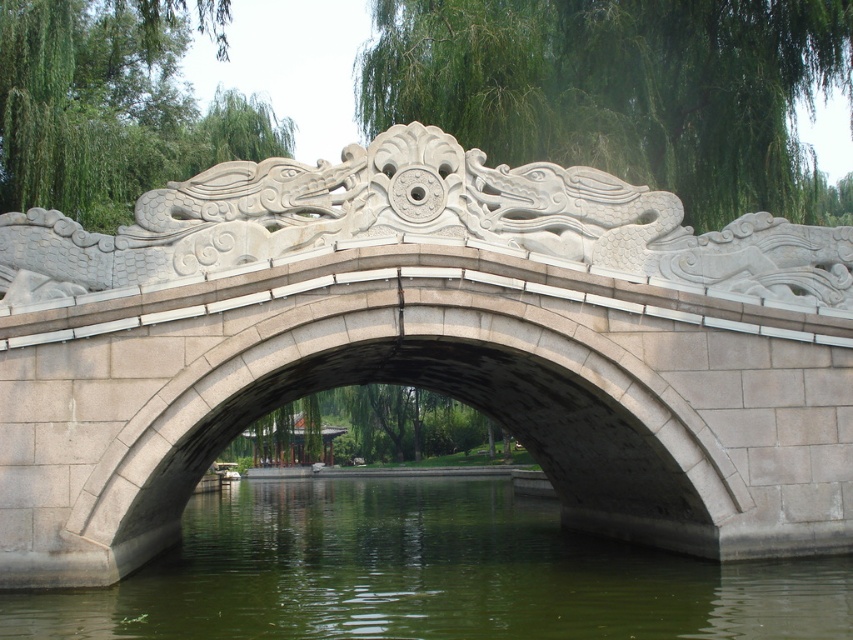
Question: Which point is closer to the camera?

Choices:
 (A) white stone bridge at center
 (B) green stone water at center

Answer: (B)

Question: Which of the following is the closest to the observer?

Choices:
 (A) green stone water at center
 (B) white stone bridge at center

Answer: (A)

Question: Which point appears farthest from the camera in this image?

Choices:
 (A) (786, 330)
 (B) (355, 584)

Answer: (B)

Question: From the image, what is the correct spatial relationship of white stone bridge at center in relation to green stone water at center?

Choices:
 (A) below
 (B) above

Answer: (B)

Question: Can you confirm if white stone bridge at center is positioned below green stone water at center?

Choices:
 (A) yes
 (B) no

Answer: (B)

Question: Does white stone bridge at center appear over green stone water at center?

Choices:
 (A) no
 (B) yes

Answer: (B)